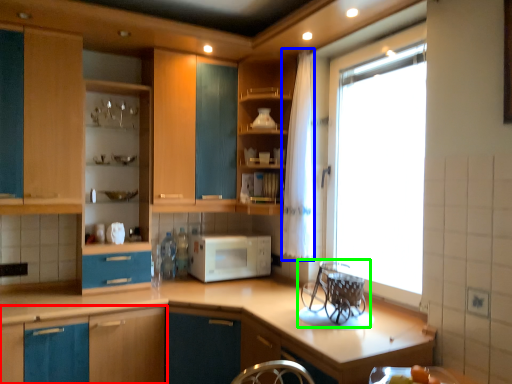
Question: Estimate the real-world distances between objects in this image. Which object is closer to cabinetry (highlighted by a red box), curtain (highlighted by a blue box) or appliance (highlighted by a green box)?

Choices:
 (A) curtain
 (B) appliance

Answer: (B)